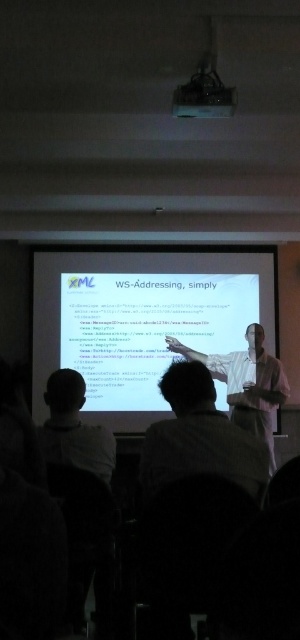
Question: Considering the relative positions of white shirt at center and matte black projector at upper center in the image provided, where is white shirt at center located with respect to matte black projector at upper center?

Choices:
 (A) right
 (B) left

Answer: (A)

Question: Can you confirm if white matte projector screen at center is positioned to the right of light brown hair at center?

Choices:
 (A) yes
 (B) no

Answer: (B)

Question: Is light brown hair at center thinner than white shirt at center?

Choices:
 (A) no
 (B) yes

Answer: (B)

Question: Which of the following is the farthest from the observer?

Choices:
 (A) matte black projector at upper center
 (B) light brown hair at center
 (C) light brown hair at lower left

Answer: (A)

Question: Which object is positioned closest to the light brown hair at center?

Choices:
 (A) white shirt at center
 (B) matte black projector at upper center
 (C) white matte projector screen at center

Answer: (B)

Question: Estimate the real-world distances between objects in this image. Which object is farther from the light brown hair at lower left?

Choices:
 (A) white matte projector screen at center
 (B) white shirt at center
 (C) matte black projector at upper center
 (D) light brown hair at center

Answer: (A)